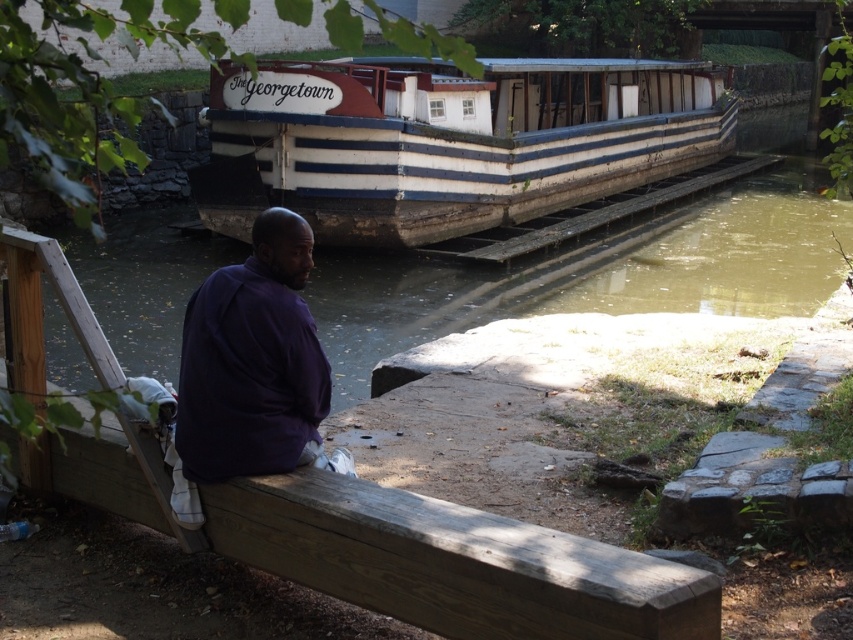
Question: From the image, what is the correct spatial relationship of wooden dock at center in relation to greenish murky water at center?

Choices:
 (A) left
 (B) right

Answer: (A)

Question: Is white painted wood boat at upper center thinner than purple matte shirt at lower left?

Choices:
 (A) yes
 (B) no

Answer: (B)

Question: Which of the following is the farthest from the observer?

Choices:
 (A) wooden dock at center
 (B) greenish murky water at center
 (C) purple matte shirt at lower left

Answer: (B)

Question: From the image, what is the correct spatial relationship of wooden dock at center in relation to purple matte shirt at lower left?

Choices:
 (A) left
 (B) right

Answer: (B)

Question: Which point appears closest to the camera in this image?

Choices:
 (A) (316, 396)
 (B) (445, 307)
 (C) (670, 625)
 (D) (444, 163)

Answer: (C)

Question: Estimate the real-world distances between objects in this image. Which object is closer to the purple matte shirt at lower left?

Choices:
 (A) white painted wood boat at upper center
 (B) wooden dock at center
 (C) greenish murky water at center

Answer: (B)